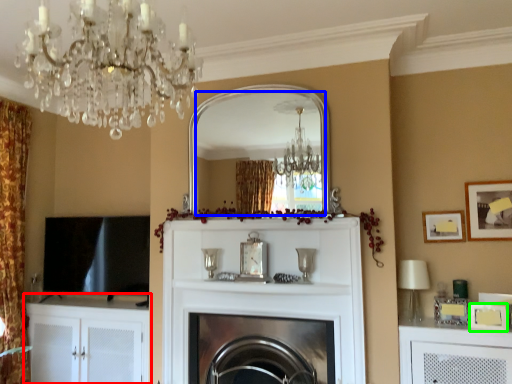
Question: Which object is the farthest from cabinetry (highlighted by a red box)? Choose among these: mirror (highlighted by a blue box) or picture frame (highlighted by a green box).

Choices:
 (A) mirror
 (B) picture frame

Answer: (B)